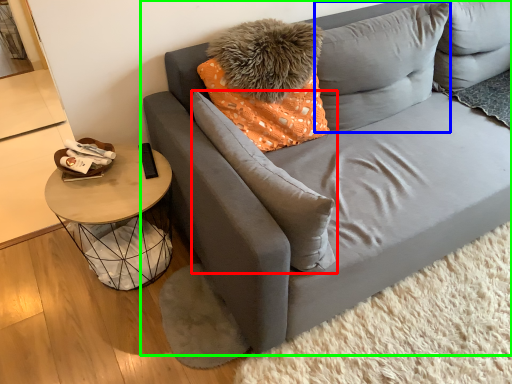
Question: Which is nearer to the pillow (highlighted by a red box)? pillow (highlighted by a blue box) or studio couch (highlighted by a green box).

Choices:
 (A) pillow
 (B) studio couch

Answer: (B)